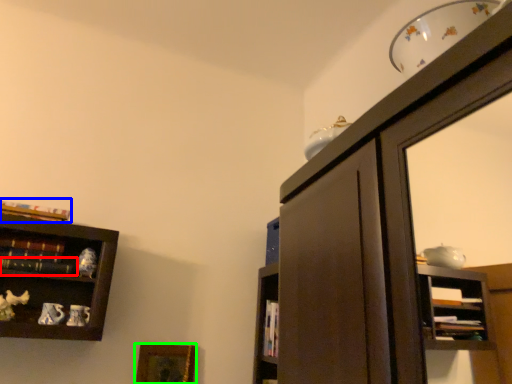
Question: Estimate the real-world distances between objects in this image. Which object is farther from book (highlighted by a red box), book (highlighted by a blue box) or picture frame (highlighted by a green box)?

Choices:
 (A) book
 (B) picture frame

Answer: (B)